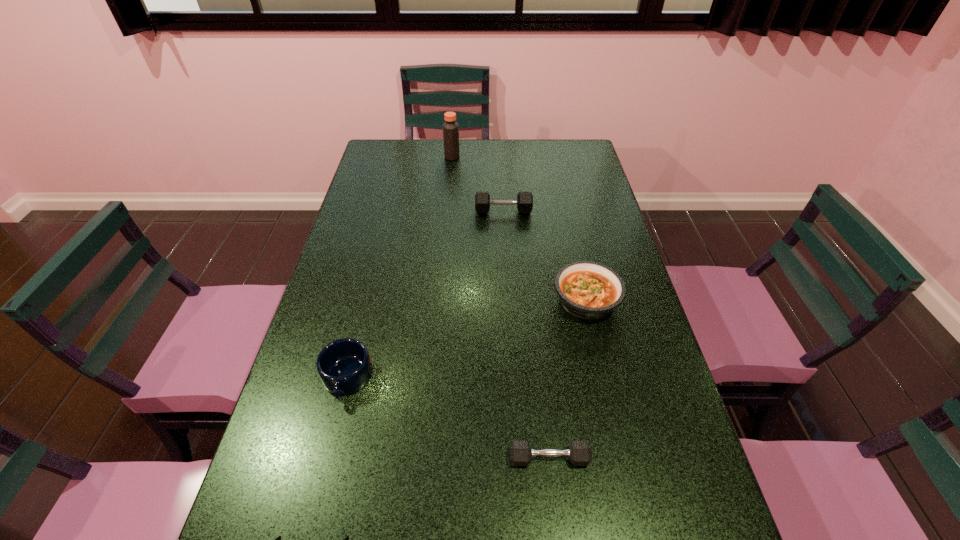
Locate an element on the screen. The height and width of the screenshot is (540, 960). free region located with the handle on the side of the mug is located at coordinates (334, 432).

What are the coordinates of `blank area located 0.150m on the back of the third farthest object` in the screenshot? It's located at (573, 244).

At what (x,y) coordinates should I click in order to perform the action: click on vacant region located on the left of the second nearest object. Please return your answer as a coordinate pair (x, y). This screenshot has height=540, width=960. Looking at the image, I should click on (370, 458).

You are a GUI agent. You are given a task and a screenshot of the screen. Output one action in this format:
    pyautogui.click(x=<x>, y=<y>)
    Task: Click on the object present at the far edge
    This screenshot has height=540, width=960.
    Given the screenshot: What is the action you would take?
    pyautogui.click(x=450, y=128)

Where is `object that is at the left edge`? object that is at the left edge is located at coordinates (344, 366).

This screenshot has height=540, width=960. Identify the location of object at the right edge. (589, 290).

At what (x,y) coordinates should I click in order to perform the action: click on free space at the far edge of the desktop. Please return your answer as a coordinate pair (x, y). Image resolution: width=960 pixels, height=540 pixels. Looking at the image, I should click on coord(490,143).

Locate an element on the screen. The image size is (960, 540). vacant space at the left edge of the desktop is located at coordinates (286, 431).

This screenshot has width=960, height=540. I want to click on free space at the right edge of the desktop, so click(584, 255).

In the image, there is a desktop. Identify the location of free region at the far left corner. The width and height of the screenshot is (960, 540). (409, 139).